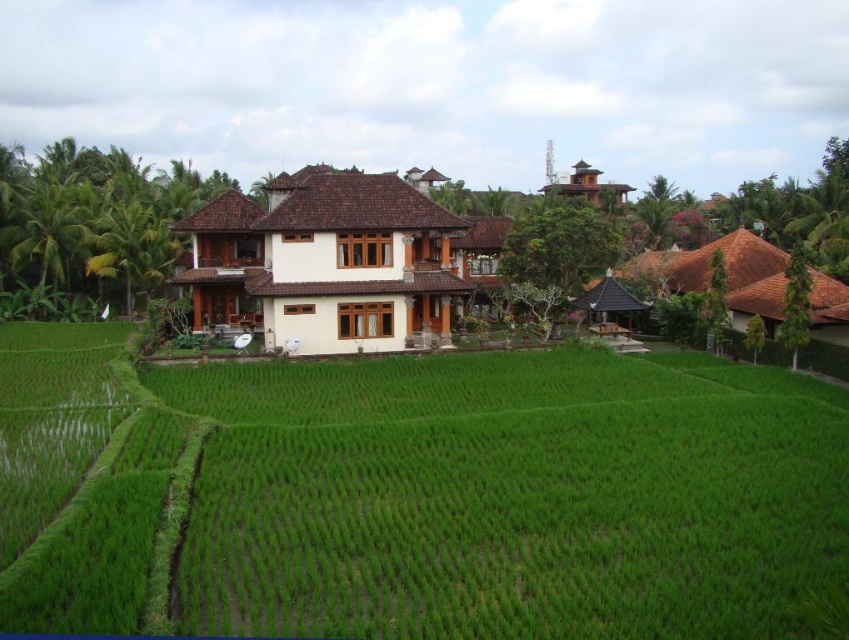
You are planning to build a small garden between the green grassy rice field at center and the wooden house at center. Since you want the garden to be as large as possible, which area should you choose to place it?

The garden should be placed between the green grassy rice field at center and the wooden house at center where the green grassy rice field at center has a larger width, allowing for a bigger garden area.

You are a visitor planning to take a photo of the white wood house at center and the wooden house at center. Which one should you choose if you want to capture the larger structure in your shot?

The white wood house at center has a larger size compared to the wooden house at center, so you should choose the white wood house at center to capture the larger structure in your shot.

You are a drone operator planning to fly a drone over the rice paddies. You need to ensure the drone can pass between the white wood house at center and the brown wooden hut at upper right. Based on their heights, can the drone safely fly over the area without hitting either structure?

The white wood house at center has a lesser height compared to brown wooden hut at upper right. Since the drone needs to fly over both structures, it must clear the taller brown wooden hut at upper right. The exact height requirement depends on the maximum height of the hut, which isn